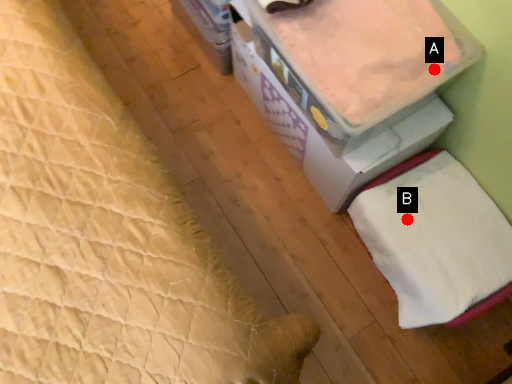
Question: Two points are circled on the image, labeled by A and B beside each circle. Which point appears farthest from the camera in this image?

Choices:
 (A) A is further
 (B) B is further

Answer: (B)